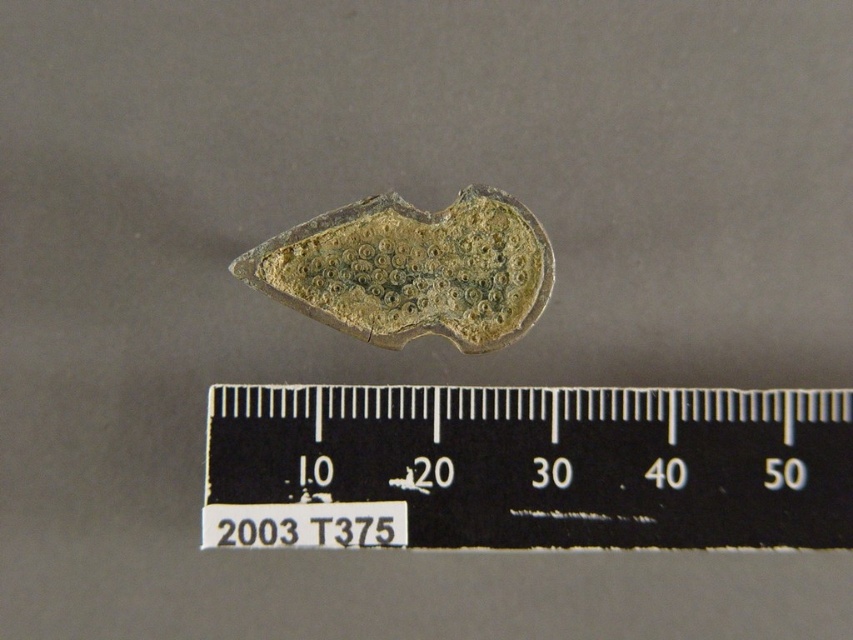
Question: Which of the following is the farthest from the observer?

Choices:
 (A) black plastic ruler at center
 (B) green patina metal at center

Answer: (B)

Question: Can you confirm if black plastic ruler at center is bigger than green patina metal at center?

Choices:
 (A) yes
 (B) no

Answer: (A)

Question: Which object is farther from the camera taking this photo?

Choices:
 (A) green patina metal at center
 (B) black plastic ruler at center

Answer: (A)

Question: Can you confirm if black plastic ruler at center is thinner than green patina metal at center?

Choices:
 (A) yes
 (B) no

Answer: (B)

Question: Which point is closer to the camera?

Choices:
 (A) black plastic ruler at center
 (B) green patina metal at center

Answer: (A)

Question: Is black plastic ruler at center below green patina metal at center?

Choices:
 (A) yes
 (B) no

Answer: (A)